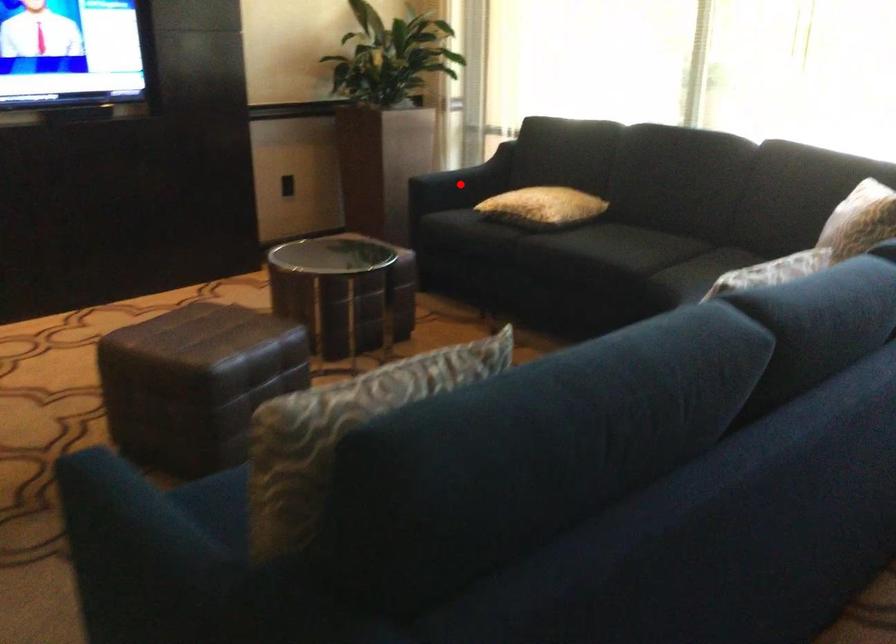
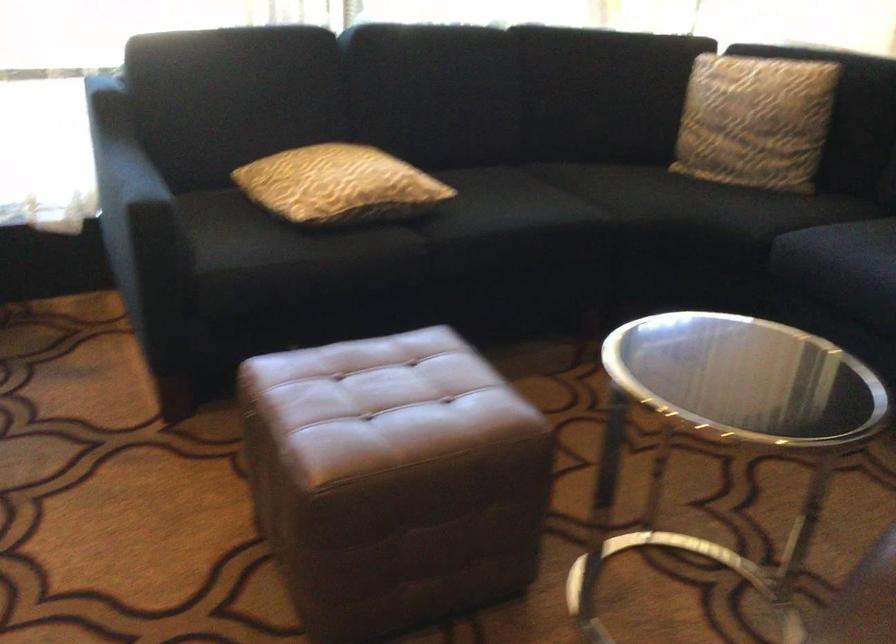
Find the pixel in the second image that matches the highlighted location in the first image.

(170, 196)